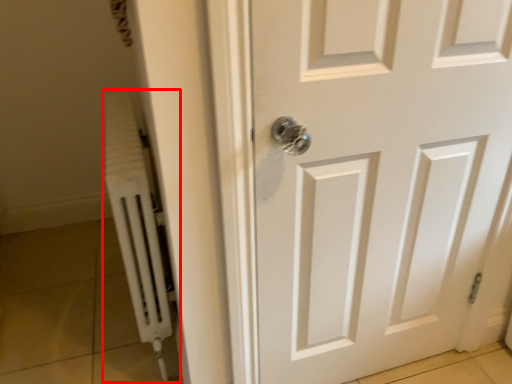
Question: From the image's perspective, what is the correct spatial positioning of radiator (annotated by the red box) in reference to door?

Choices:
 (A) above
 (B) below

Answer: (A)